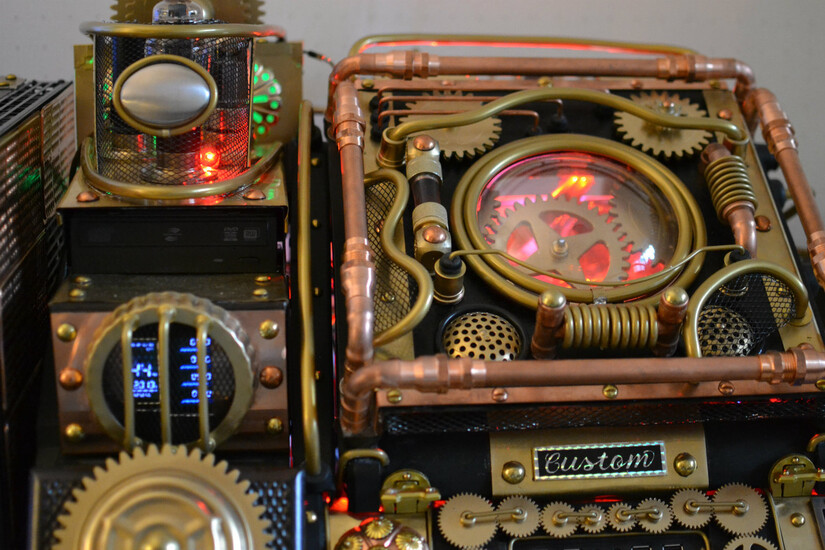
I want to click on custom name plate, so click(x=592, y=464).